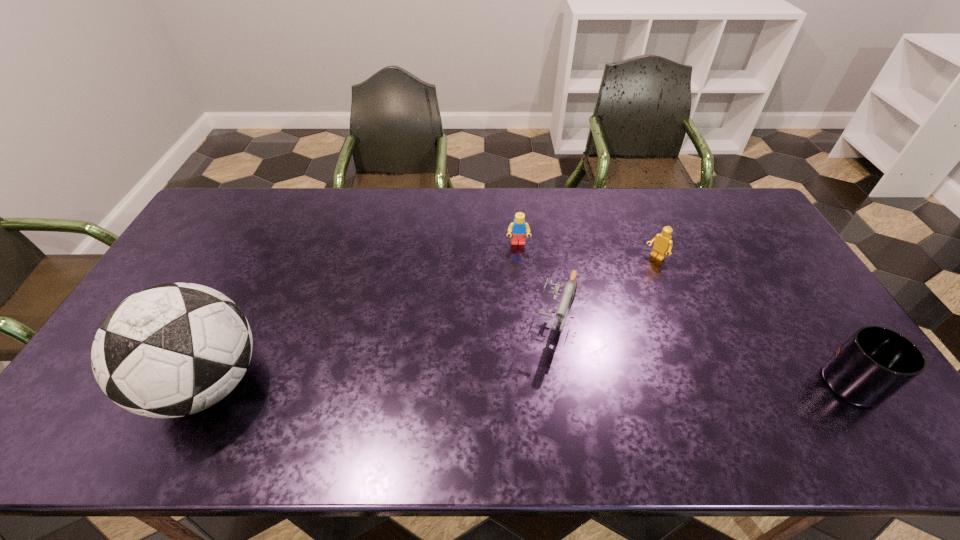
Where is `free spot between the left Lego and the fourth object from left to right`? free spot between the left Lego and the fourth object from left to right is located at coordinates (587, 251).

Identify which object is the closest to the gun. Please provide its 2D coordinates. Your answer should be formatted as a tuple, i.e. [(x, y)], where the tuple contains the x and y coordinates of a point satisfying the conditions above.

[(518, 228)]

Identify which object is located as the nearest to the rightmost object. Please provide its 2D coordinates. Your answer should be formatted as a tuple, i.e. [(x, y)], where the tuple contains the x and y coordinates of a point satisfying the conditions above.

[(663, 244)]

Image resolution: width=960 pixels, height=540 pixels. In order to click on free region that satisfies the following two spatial constraints: 1. on the front side of the farther Lego; 2. on the left side of the gun in this screenshot , I will do `click(525, 321)`.

Locate an element on the screen. The image size is (960, 540). vacant space that satisfies the following two spatial constraints: 1. on the front side of the mug; 2. with the handle on the side of the left Lego is located at coordinates (531, 383).